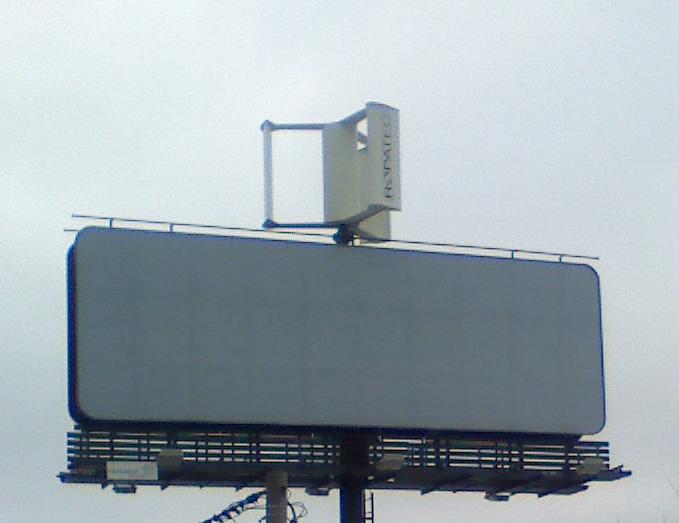
Identify the location of metal bracket. This screenshot has width=679, height=523. (344, 235).